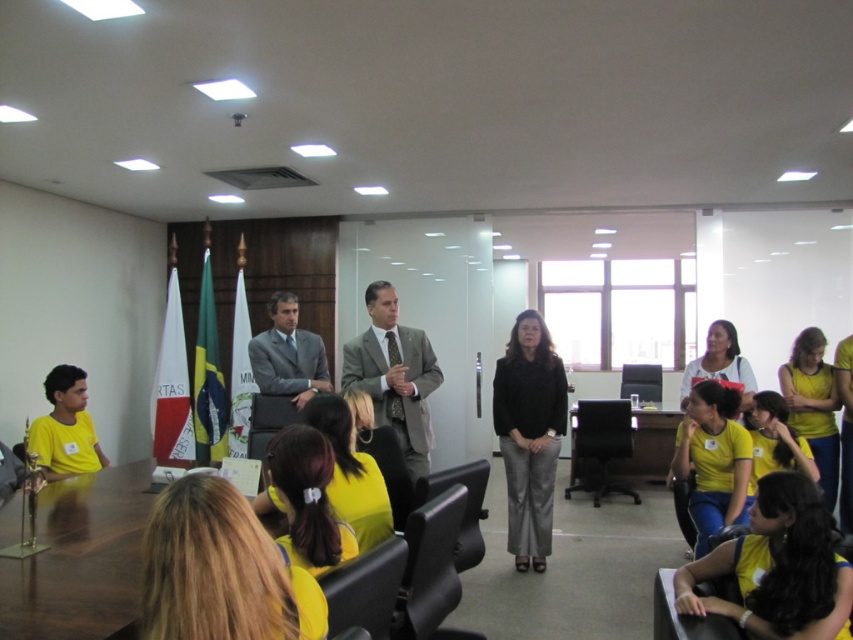
You are standing in the conference room and want to move from point A to point B. Point A is at coordinates point [73,563] and point B is at coordinates point [751,618]. Which point is closer to you?

Point point [73,563] is closer to you than point point [751,618] because it is further to the viewer.

You are standing in the conference room and want to take a photo of both point (798, 600) and point (320, 376). Which point should you focus on first to ensure both are in clear view?

You should focus on point (798, 600) first because it is closer to the camera than point (320, 376), ensuring both points are in focus.